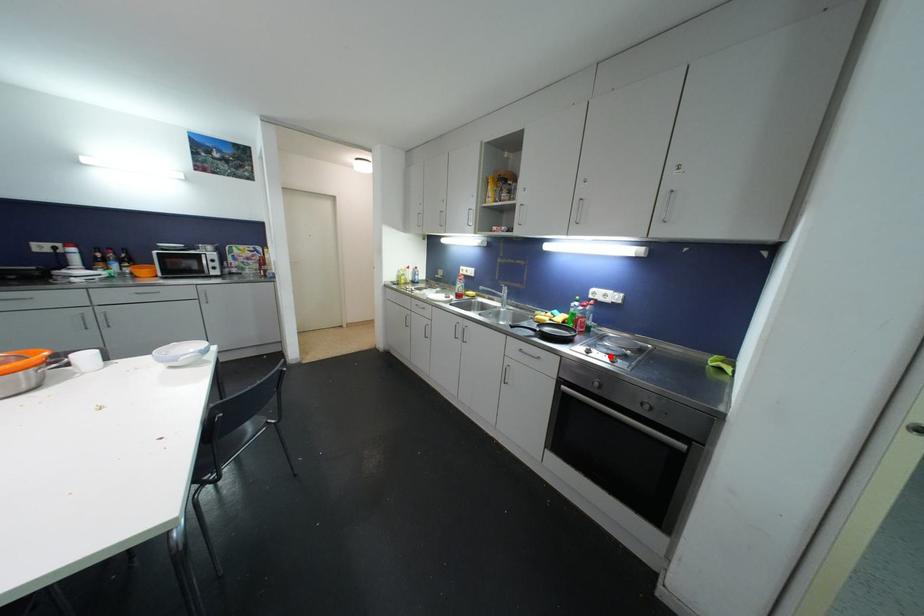
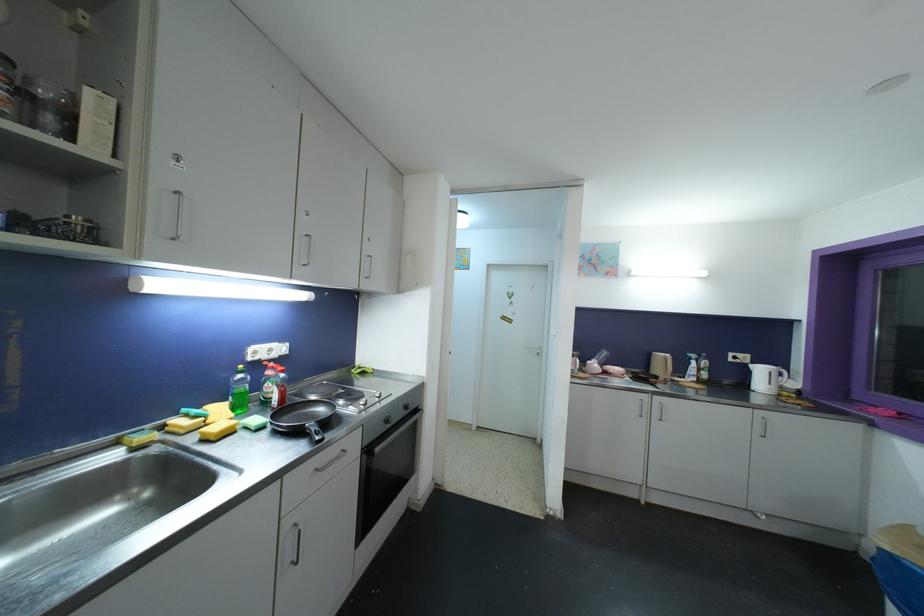
Where in the second image is the point corresponding to the highlighted location from the first image?

(366, 400)